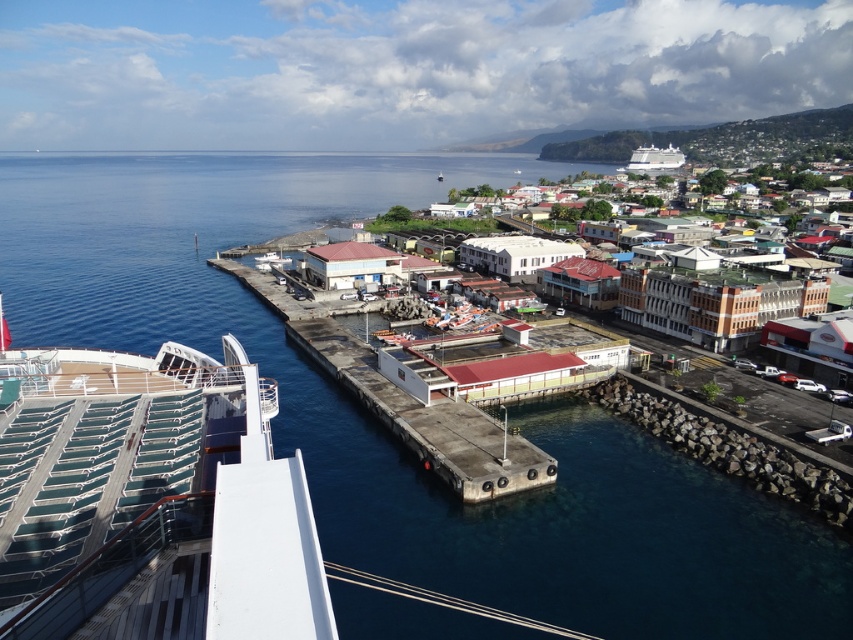
You are a passenger on the cruise ship and want to take a photo of the white matte boat at center. Since you are on the white glossy cruise ship at upper right, will the boat be visible in your photo if you face towards the dock?

A: The white matte boat at center is behind the white glossy cruise ship at upper right, so if you are on the cruise ship and facing towards the dock, the boat would be obstructed by the ship and not visible in your photo.

You are a passenger on the cruise ship and want to compare the size of the teal plastic deck at lower left and the white matte boat at center. Which one is larger?

The teal plastic deck at lower left is bigger than the white matte boat at center according to the description.

You are a passenger on the white glossy cruise ship at upper right and want to get to the white matte boat at center. Which direction should you go to reach it?

The white glossy cruise ship at upper right is positioned over the white matte boat at center, so you should go downward to reach it.